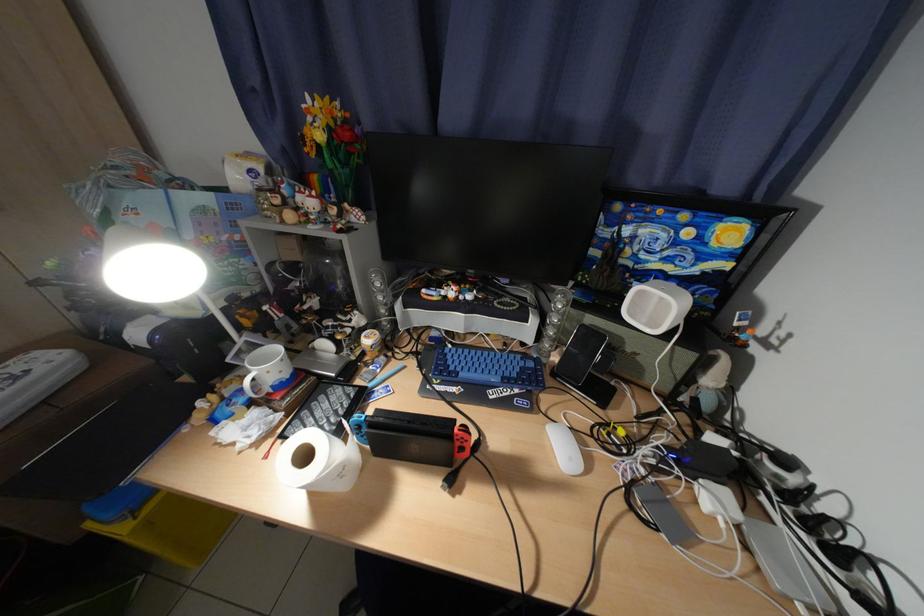
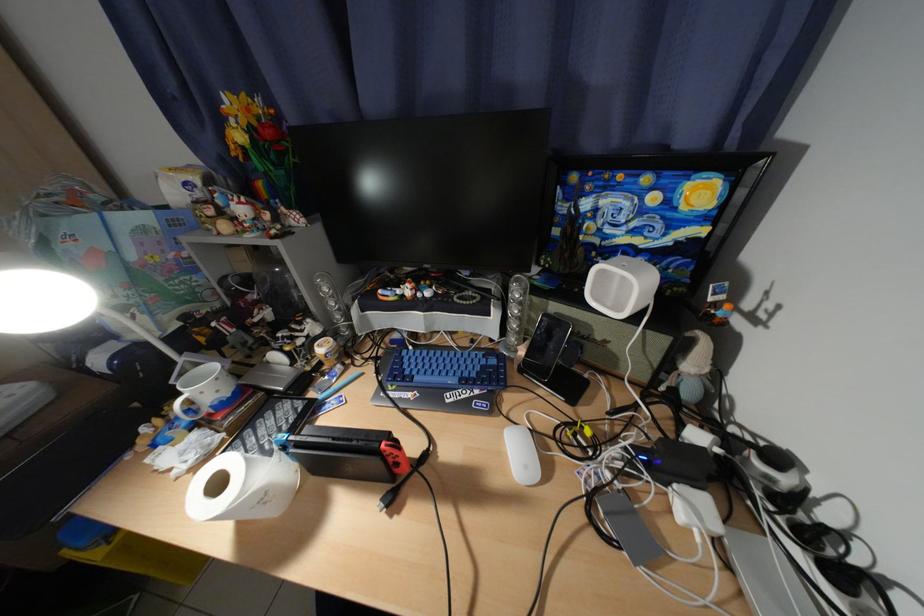
The point at (723, 382) is marked in the first image. Where is the corresponding point in the second image?

(704, 367)